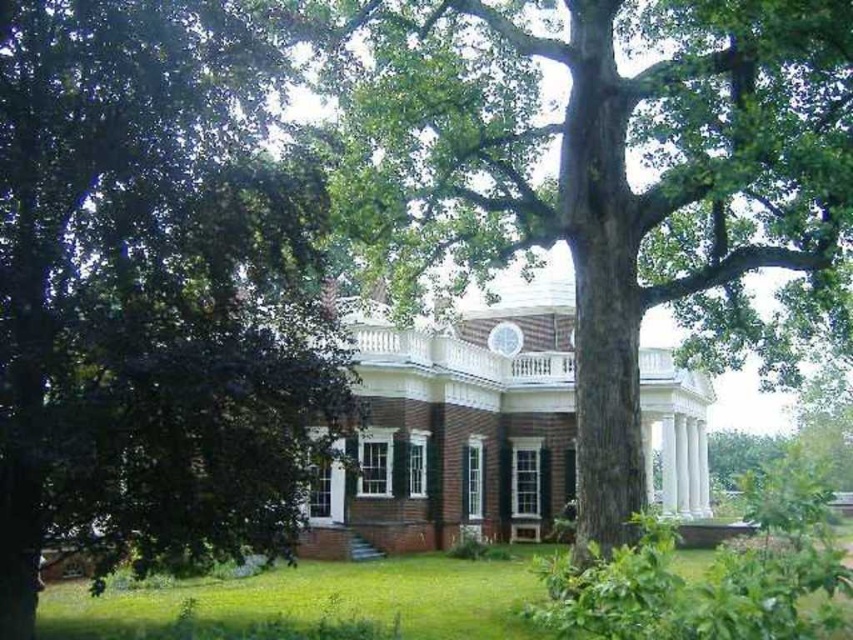
Does green leafy tree at left lie behind green grass at lower center?

That is False.

Between green leafy tree at left and green grass at lower center, which one has more height?

green leafy tree at left is taller.

Which is in front, point (265, 525) or point (505, 577)?

Positioned in front is point (265, 525).

Where is `green leafy tree at left`? The width and height of the screenshot is (853, 640). green leafy tree at left is located at coordinates (x=154, y=288).

This screenshot has width=853, height=640. Identify the location of smooth brown tree trunk at center. (608, 176).

How far apart are smooth brown tree trunk at center and green grass at lower center?

smooth brown tree trunk at center and green grass at lower center are 30.49 feet apart from each other.

Image resolution: width=853 pixels, height=640 pixels. Find the location of `smooth brown tree trunk at center`. smooth brown tree trunk at center is located at coordinates (608, 176).

Is green leafy tree at left bigger than smooth brown tree trunk at center?

Actually, green leafy tree at left might be smaller than smooth brown tree trunk at center.

You are a GUI agent. You are given a task and a screenshot of the screen. Output one action in this format:
    pyautogui.click(x=<x>, y=<y>)
    Task: Click on the green leafy tree at left
    
    Given the screenshot: What is the action you would take?
    pyautogui.click(x=154, y=288)